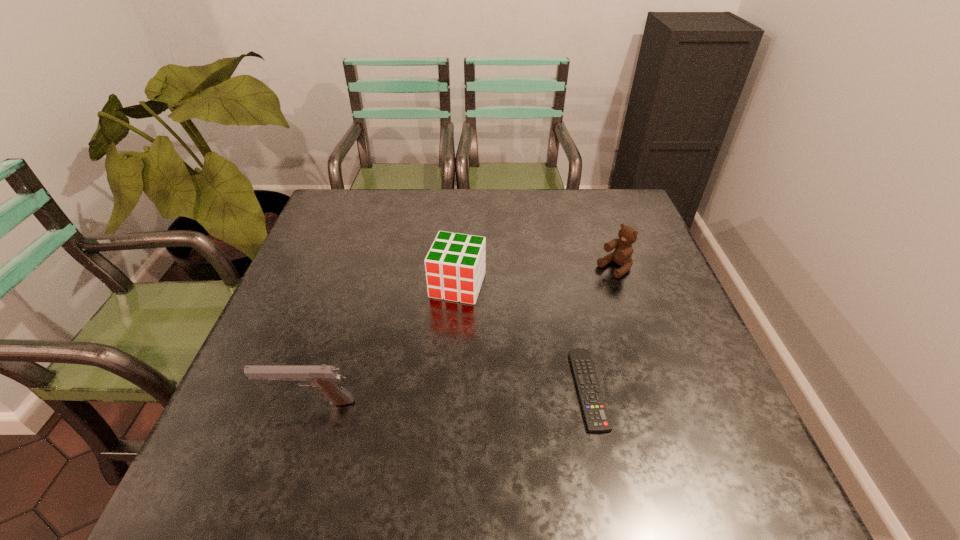
Locate an element on the screen. The image size is (960, 540). vacant region at the far left corner of the desktop is located at coordinates (347, 202).

Find the location of `vacant space at the far right corner of the desktop`. vacant space at the far right corner of the desktop is located at coordinates (583, 192).

The image size is (960, 540). In the image, there is a desktop. In order to click on vacant space at the near right corner in this screenshot , I will do `click(674, 429)`.

This screenshot has width=960, height=540. I want to click on vacant space that's between the rightmost object and the pistol, so click(x=462, y=335).

Locate an element on the screen. This screenshot has height=540, width=960. unoccupied area between the remote control and the teddy bear is located at coordinates (601, 328).

The image size is (960, 540). I want to click on free space between the third object from left to right and the cube, so click(x=523, y=337).

The width and height of the screenshot is (960, 540). In order to click on empty location between the rightmost object and the shortest object in this screenshot , I will do `click(601, 328)`.

I want to click on unoccupied area between the leftmost object and the teddy bear, so click(462, 335).

This screenshot has width=960, height=540. What are the coordinates of `vacant space that's between the teddy bear and the third object from right to left` in the screenshot? It's located at (536, 276).

Find the location of `vacant area between the leftmost object and the teddy bear`. vacant area between the leftmost object and the teddy bear is located at coordinates (462, 335).